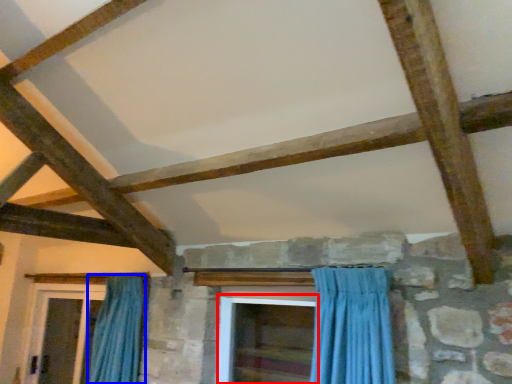
Question: Which object appears closest to the camera in this image, screen door (highlighted by a red box) or curtain (highlighted by a blue box)?

Choices:
 (A) screen door
 (B) curtain

Answer: (A)